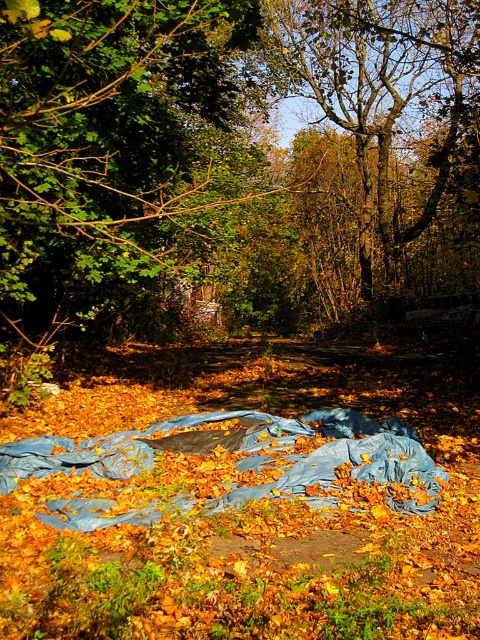
You are an observer standing in the middle of the autumn woods. You notice a green leafy tree at upper left and a brown textured tree at upper center. Which tree would cast a longer shadow during midday?

The brown textured tree at upper center is taller than the green leafy tree at upper left, so it would cast a longer shadow during midday.

You are standing in the autumn woods and notice a blue tarp on the ground. There are two trees in your view, the green leafy tree at upper left and the brown textured tree at upper center. Which tree is positioned lower in the scene?

The green leafy tree at upper left is positioned lower than the brown textured tree at upper center as it is described to be below it.

In the scene shown: You are standing in the autumnal wooded area and want to locate the green leafy tree at upper left. According to the coordinates given, where would you find it?

The green leafy tree at upper left is located at coordinates point (112, 148).